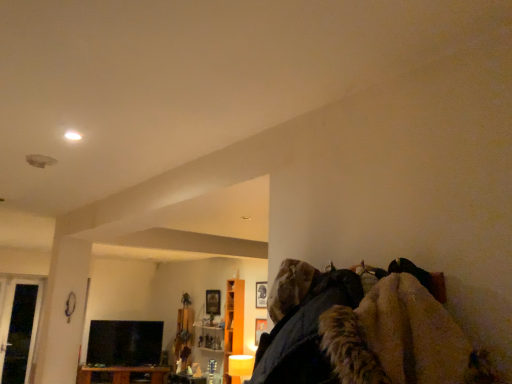
Question: Can you confirm if black glossy tv at lower left is wider than transparent glass door at left?

Choices:
 (A) no
 (B) yes

Answer: (A)

Question: From a real-world perspective, is black glossy tv at lower left physically above transparent glass door at left?

Choices:
 (A) yes
 (B) no

Answer: (B)

Question: Is black glossy tv at lower left completely or partially outside of transparent glass door at left?

Choices:
 (A) yes
 (B) no

Answer: (A)

Question: Is black glossy tv at lower left oriented towards transparent glass door at left?

Choices:
 (A) no
 (B) yes

Answer: (A)

Question: From the image's perspective, is black glossy tv at lower left beneath transparent glass door at left?

Choices:
 (A) no
 (B) yes

Answer: (B)

Question: From a real-world perspective, does black glossy tv at lower left sit lower than transparent glass door at left?

Choices:
 (A) yes
 (B) no

Answer: (A)

Question: Considering the relative positions of transparent glass door at left and brown wood cabinet at lower left in the image provided, is transparent glass door at left to the right of brown wood cabinet at lower left from the viewer's perspective?

Choices:
 (A) yes
 (B) no

Answer: (B)

Question: Is transparent glass door at left positioned far away from brown wood cabinet at lower left?

Choices:
 (A) no
 (B) yes

Answer: (B)

Question: Would you say brown wood cabinet at lower left is part of transparent glass door at left's contents?

Choices:
 (A) yes
 (B) no

Answer: (B)

Question: From the image's perspective, is transparent glass door at left on brown wood cabinet at lower left?

Choices:
 (A) yes
 (B) no

Answer: (A)

Question: From a real-world perspective, is transparent glass door at left on top of brown wood cabinet at lower left?

Choices:
 (A) yes
 (B) no

Answer: (A)

Question: Does transparent glass door at left have a smaller size compared to brown wood cabinet at lower left?

Choices:
 (A) yes
 (B) no

Answer: (A)

Question: Considering the relative positions of orange wood cabinet at center and brown wood cabinet at lower left in the image provided, is orange wood cabinet at center behind brown wood cabinet at lower left?

Choices:
 (A) no
 (B) yes

Answer: (A)